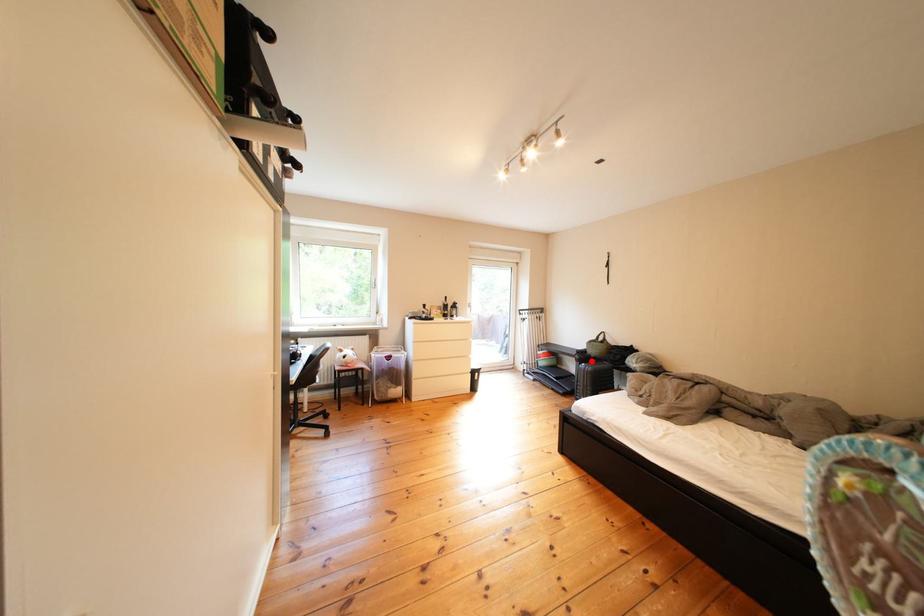
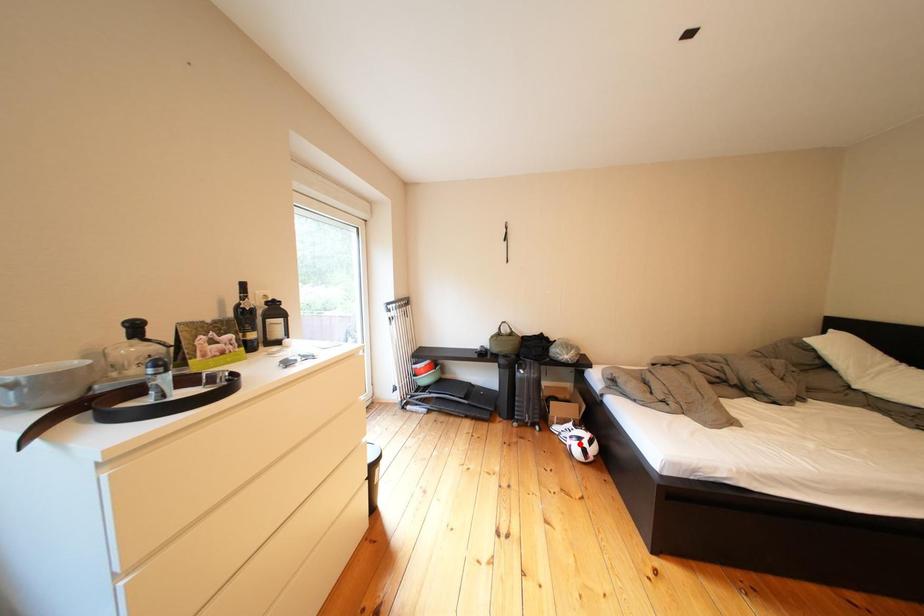
I am providing you with two images of the same scene from different viewpoints. A red point is marked on the first image and another point is marked on the second image. Are the points marked in image1 and image2 representing the same 3D position?

No